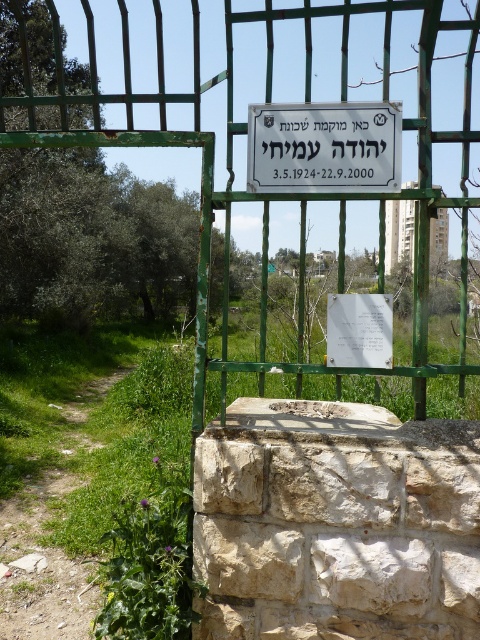
You are planning to walk from the green grassy path at lower left to the white paper at center. Which path is wider?

The green grassy path at lower left might be wider than white paper at center.

You need to attach a new sign that is the same size as the white plastic sign at center to the green metal gate at center. Can the new sign fit on the gate without overlapping the existing sign?

The green metal gate at center is wider than the white plastic sign at center. Therefore, the new sign of the same size as the white plastic sign at center can fit on the green metal gate at center without overlapping the existing sign.

You are a visitor approaching the entrance of the grassy area and see the green metal gate at center and the white plastic sign at center. Which object is bigger in size?

The green metal gate at center has a larger size compared to the white plastic sign at center.